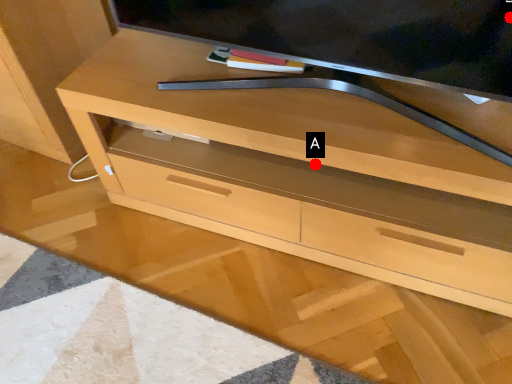
Question: Two points are circled on the image, labeled by A and B beside each circle. Among these points, which one is nearest to the camera?

Choices:
 (A) A is closer
 (B) B is closer

Answer: (B)